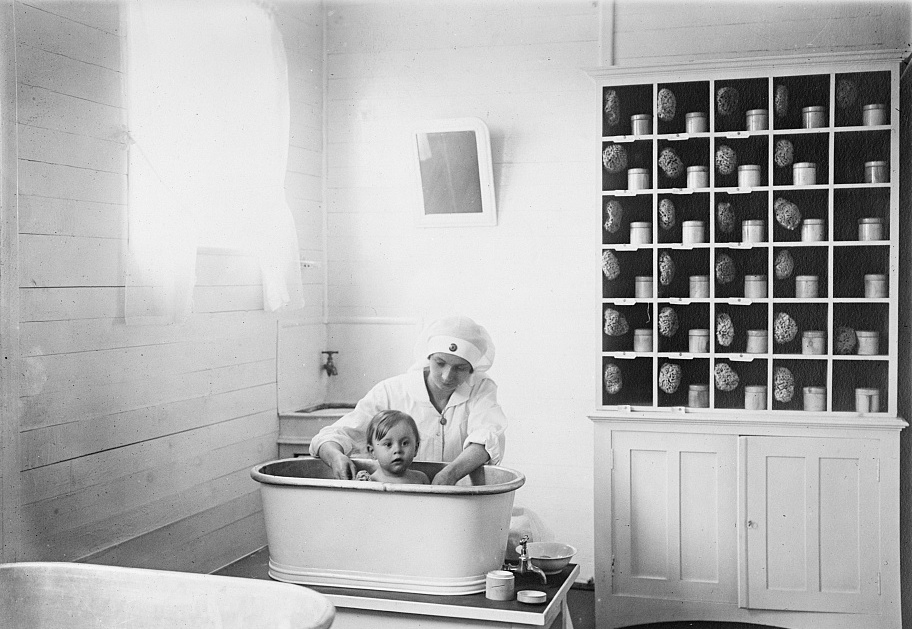
Where is `bowl`? bowl is located at coordinates (551, 550).